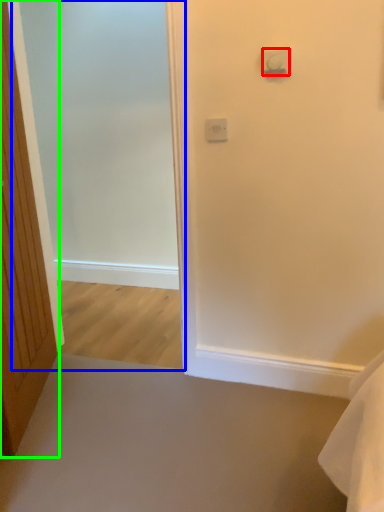
Question: Which is nearer to the light switch (highlighted by a red box)? screen door (highlighted by a blue box) or door (highlighted by a green box).

Choices:
 (A) screen door
 (B) door

Answer: (B)